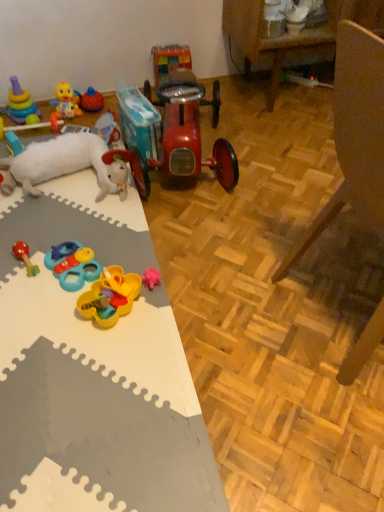
This screenshot has width=384, height=512. Find the location of `vacant space that is to the left of plastic/soft yellow and blue toy at lower left, the 4th toy viewed from the right`. vacant space that is to the left of plastic/soft yellow and blue toy at lower left, the 4th toy viewed from the right is located at coordinates (24, 270).